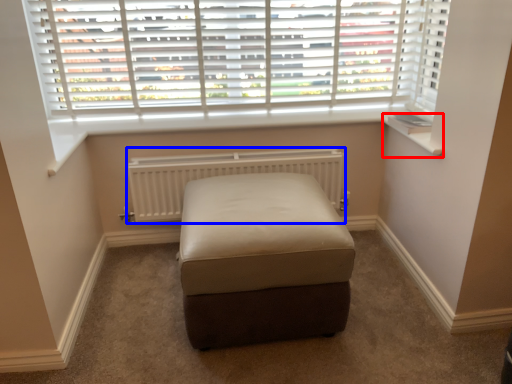
Question: Which point is closer to the camera, window sill (highlighted by a red box) or radiator (highlighted by a blue box)?

Choices:
 (A) window sill
 (B) radiator

Answer: (A)